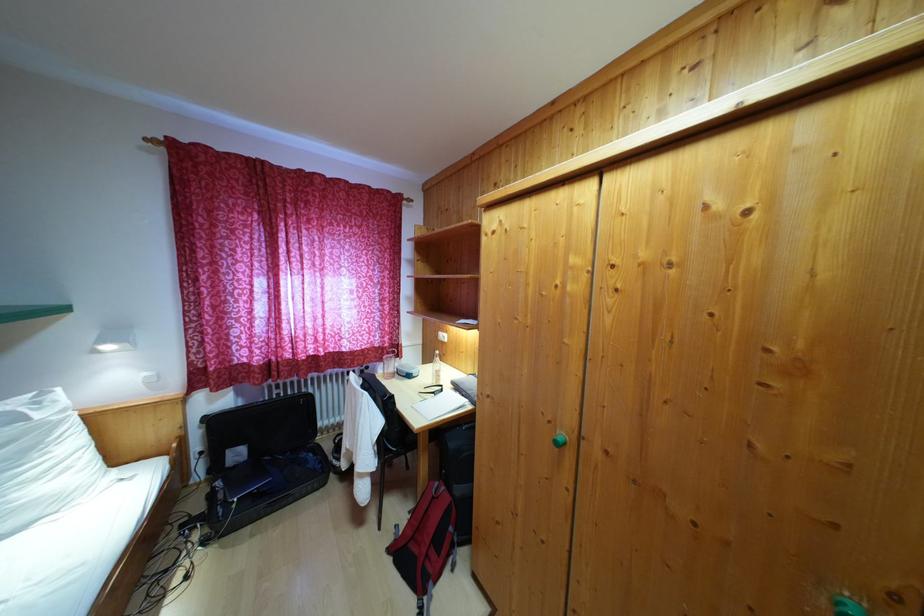
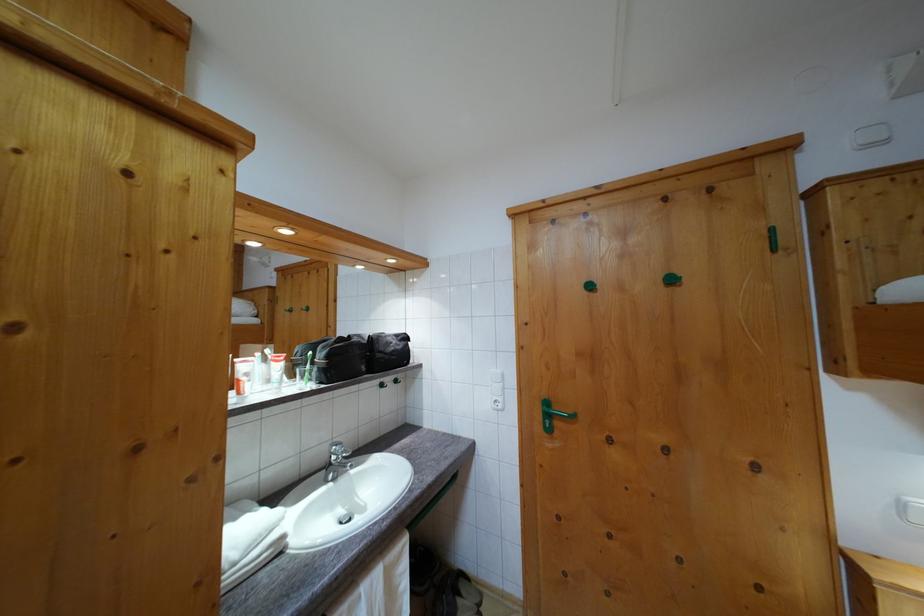
Question: The camera is either moving clockwise (left) or counter-clockwise (right) around the object. The first image is from the beginning of the video and the second image is from the end. Is the camera moving left or right when shooting the video?

Choices:
 (A) Left
 (B) Right

Answer: (A)